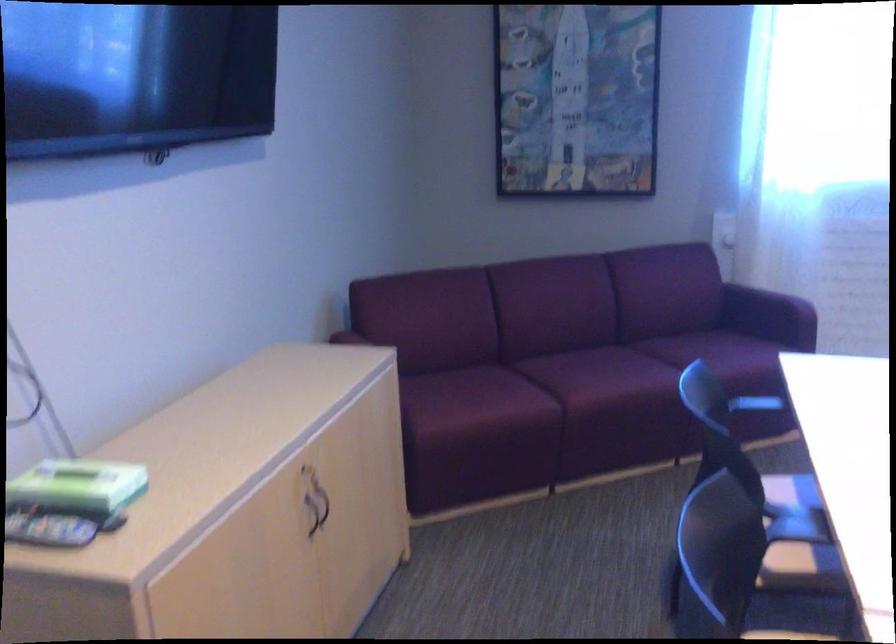
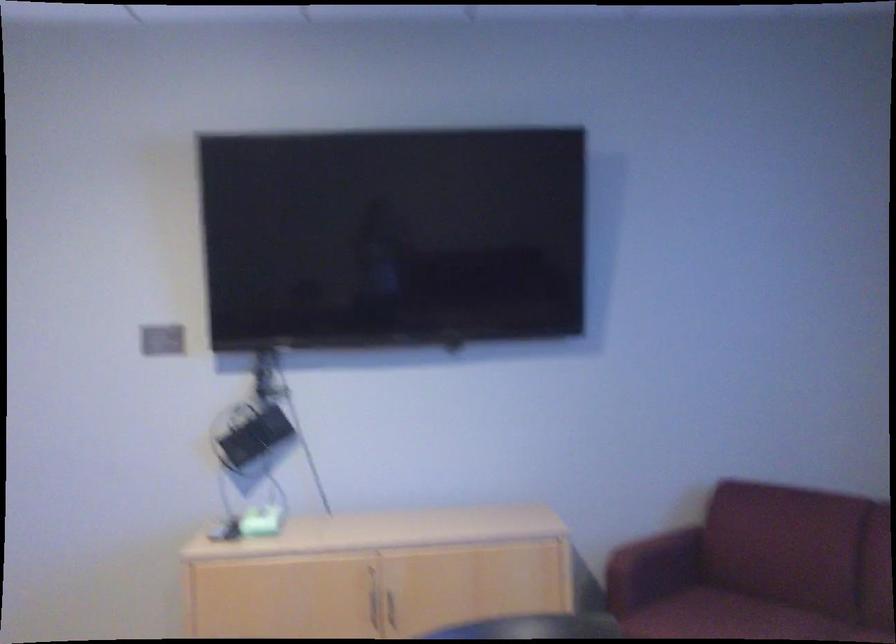
Find the pixel in the second image that matches the point at 115,484 in the first image.

(257, 522)